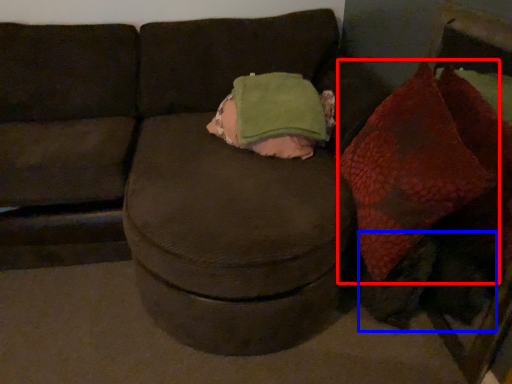
Question: Which object is closer to the camera taking this photo, bean bag chair (highlighted by a red box) or animal (highlighted by a blue box)?

Choices:
 (A) bean bag chair
 (B) animal

Answer: (A)